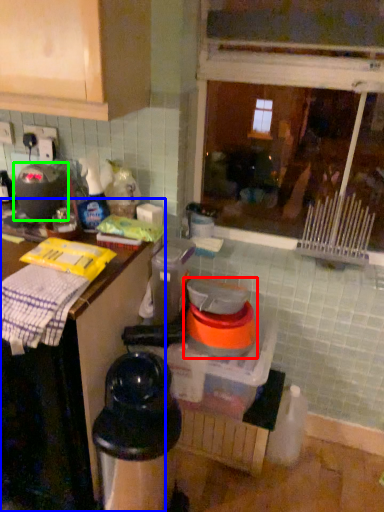
Question: Based on their relative distances, which object is farther from appliance (highlighted by a red box)? Choose from countertop (highlighted by a blue box) and appliance (highlighted by a green box).

Choices:
 (A) countertop
 (B) appliance

Answer: (B)